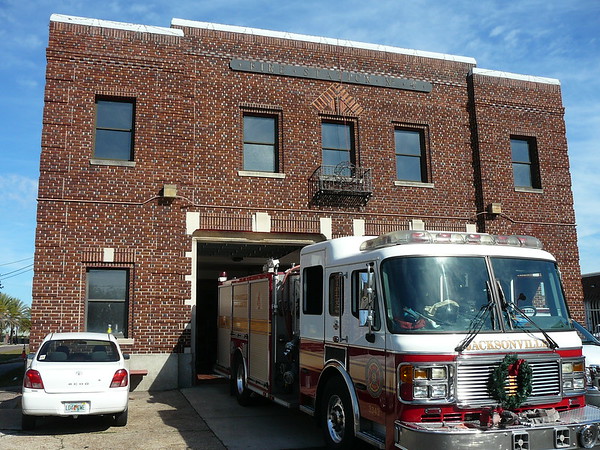
Find the location of a particular element. The width and height of the screenshot is (600, 450). window is located at coordinates (339, 137).